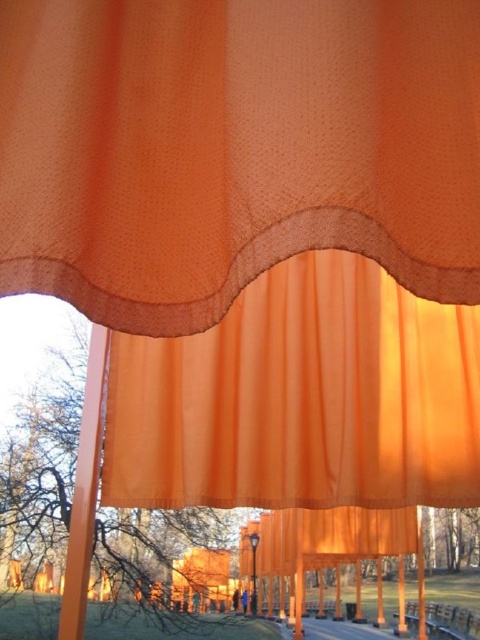
Who is taller, translucent orange curtain at upper center or orange sheer curtain at center?

orange sheer curtain at center is taller.

Between translucent orange curtain at upper center and orange sheer curtain at center, which one appears on the right side from the viewer's perspective?

Positioned to the right is orange sheer curtain at center.

Between point (417, 177) and point (359, 304), which one is positioned behind?

The point (359, 304) is more distant.

The image size is (480, 640). Identify the location of translucent orange curtain at upper center. (233, 148).